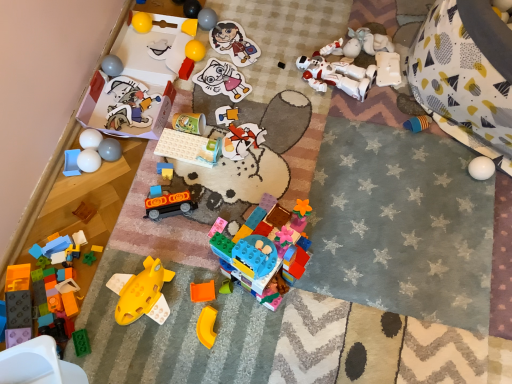
Identify the location of empty space that is in between matte plastic sticker at upper center, marked as the fourth toy in a right-to-left arrangement, and translucent orange plastic at center, the fifth toy in the right-to-left sequence. The height and width of the screenshot is (384, 512). (230, 129).